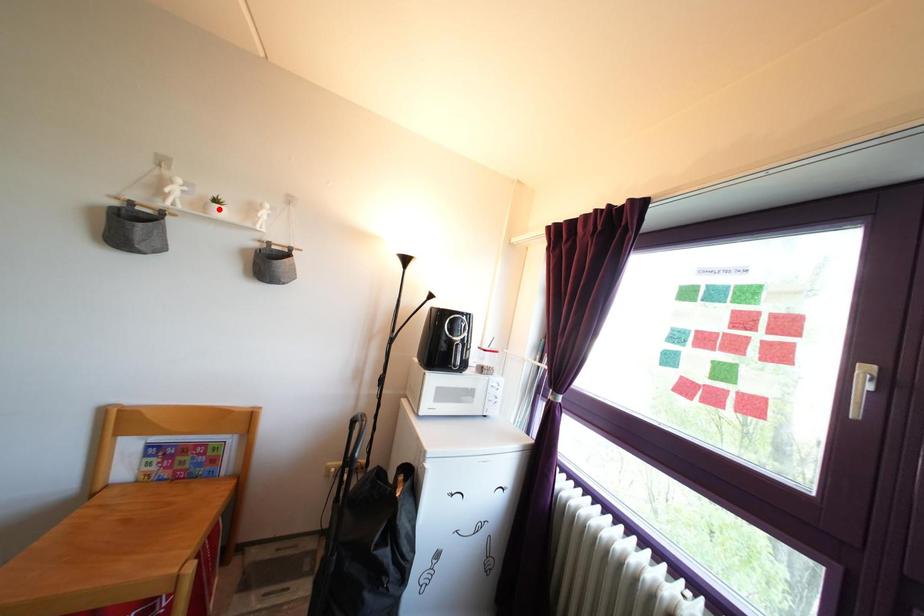
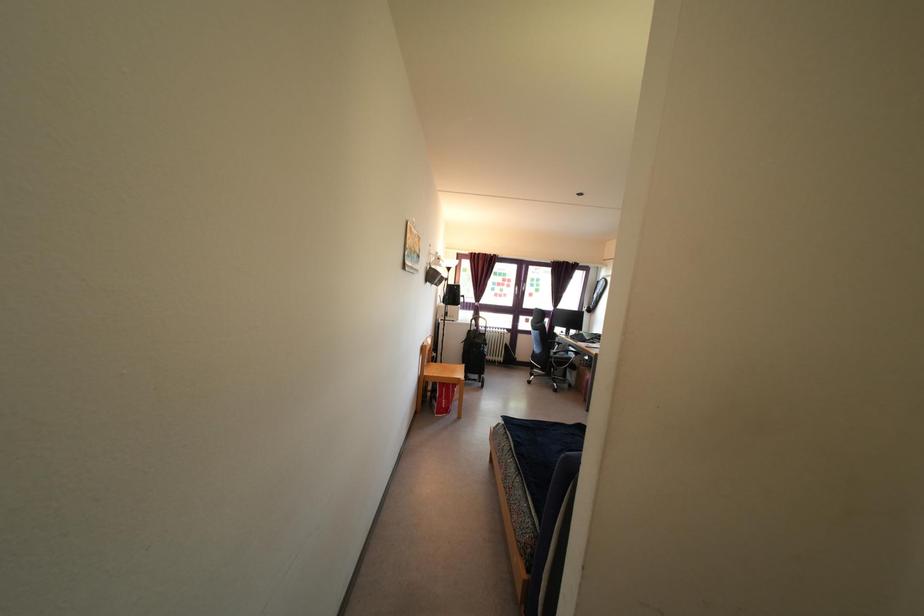
Question: I am providing you with two images of the same scene from different viewpoints. A red point is marked on the first image. Is the red point's position out of view in image 2?

Choices:
 (A) Yes
 (B) No

Answer: (A)